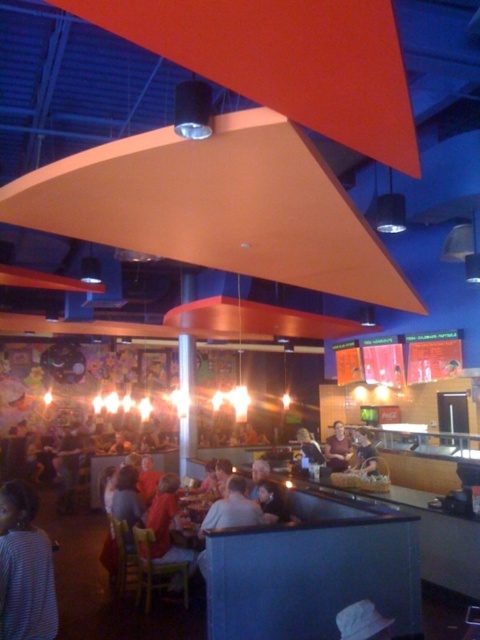
Which is below, striped shirt at lower left or dark brown leather jacket at center?

dark brown leather jacket at center is below.

Does striped shirt at lower left come in front of dark brown leather jacket at center?

Yes, striped shirt at lower left is in front of dark brown leather jacket at center.

This screenshot has height=640, width=480. Find the location of `striped shirt at lower left`. striped shirt at lower left is located at coordinates (24, 568).

Image resolution: width=480 pixels, height=640 pixels. In order to click on striped shirt at lower left in this screenshot , I will do pos(24,568).

Is light brown leather jacket at lower center smaller than smooth beige shirt at center?

Actually, light brown leather jacket at lower center might be larger than smooth beige shirt at center.

Is light brown leather jacket at lower center bigger than smooth beige shirt at center?

Correct, light brown leather jacket at lower center is larger in size than smooth beige shirt at center.

Between point (216, 518) and point (360, 433), which one is positioned behind?

The point (360, 433) is behind.

What are the coordinates of `light brown leather jacket at lower center` in the screenshot? It's located at (232, 509).

Is dark brown leather jacket at center positioned in front of smooth beige shirt at center?

No.

Which is below, dark brown leather jacket at center or smooth beige shirt at center?

Positioned lower is dark brown leather jacket at center.

The image size is (480, 640). Find the location of `dark brown leather jacket at center`. dark brown leather jacket at center is located at coordinates (337, 449).

Identify the location of dark brown leather jacket at center. (337, 449).